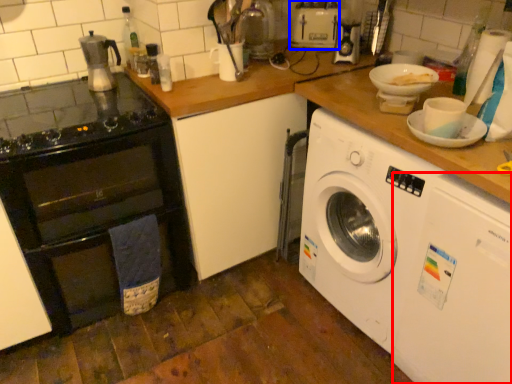
Question: Which object is closer to the camera taking this photo, washing machine (highlighted by a red box) or appliance (highlighted by a blue box)?

Choices:
 (A) washing machine
 (B) appliance

Answer: (A)